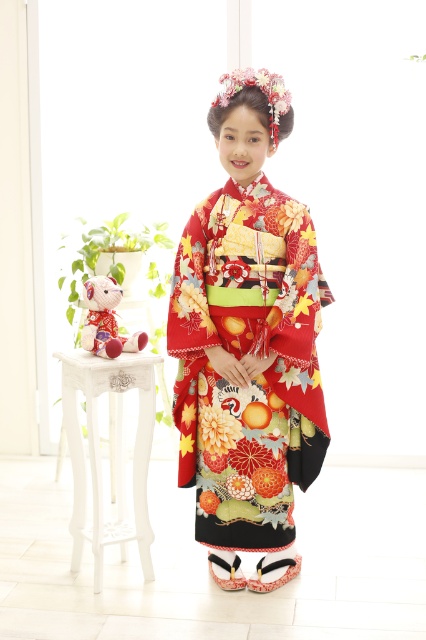
Does floral silk kimono at center appear on the right side of velvet plush bear at left?

Yes, floral silk kimono at center is to the right of velvet plush bear at left.

Based on the photo, does floral silk kimono at center have a lesser height compared to velvet plush bear at left?

No.

Describe the element at coordinates (244, 356) in the screenshot. Image resolution: width=426 pixels, height=640 pixels. I see `floral silk kimono at center` at that location.

Where is `floral silk kimono at center`? This screenshot has height=640, width=426. floral silk kimono at center is located at coordinates (244, 356).

Between white wood stool at left and velvet plush bear at left, which one appears on the left side from the viewer's perspective?

Positioned to the left is white wood stool at left.

Measure the distance from white wood stool at left to velvet plush bear at left.

white wood stool at left is 36.71 centimeters away from velvet plush bear at left.

What do you see at coordinates (109, 451) in the screenshot? Image resolution: width=426 pixels, height=640 pixels. I see `white wood stool at left` at bounding box center [109, 451].

At what (x,y) coordinates should I click in order to perform the action: click on white wood stool at left. Please return your answer as a coordinate pair (x, y). Looking at the image, I should click on (109, 451).

In the scene shown: Which is more to the left, floral silk kimono at center or white wood stool at left?

Result: Positioned to the left is white wood stool at left.

Can you confirm if floral silk kimono at center is thinner than white wood stool at left?

No.

The height and width of the screenshot is (640, 426). What are the coordinates of `floral silk kimono at center` in the screenshot? It's located at (244, 356).